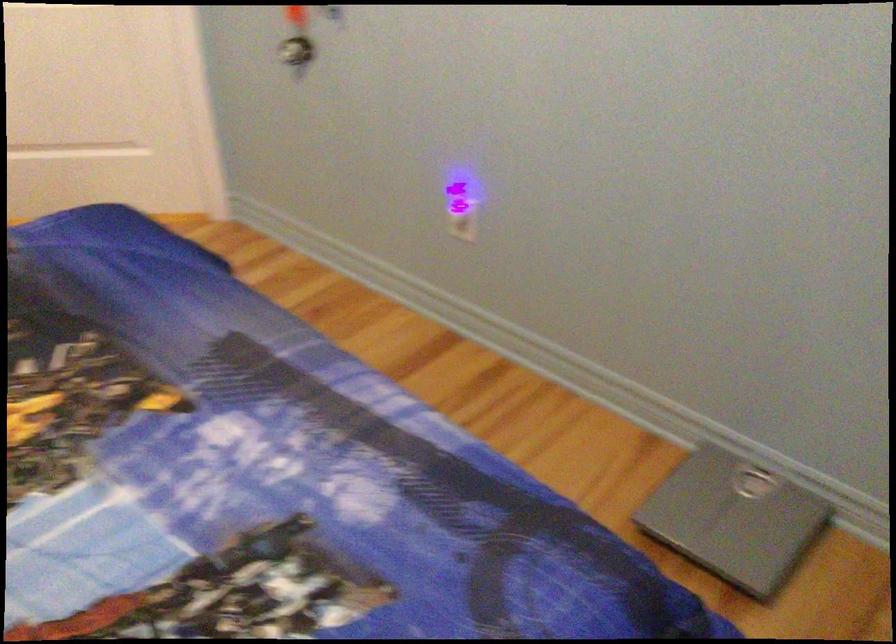
Image resolution: width=896 pixels, height=644 pixels. Describe the element at coordinates (462, 202) in the screenshot. I see `the glowing night light` at that location.